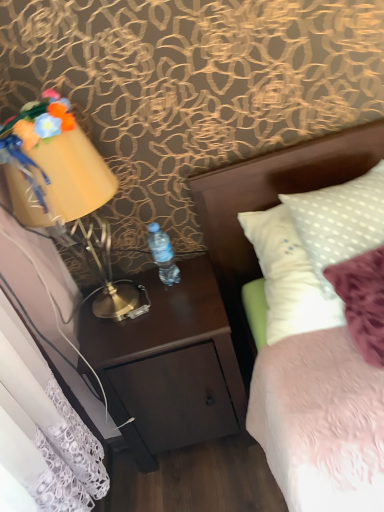
Question: From a real-world perspective, is matte yellow lampshade at left above or below fluffy fabric flowers at upper left?

Choices:
 (A) below
 (B) above

Answer: (A)

Question: Is point (142, 311) closer or farther from the camera than point (24, 120)?

Choices:
 (A) farther
 (B) closer

Answer: (A)

Question: Which object is the farthest from the fluffy fabric flowers at upper left?

Choices:
 (A) matte yellow lampshade at left
 (B) white fabric headboard at upper right
 (C) clear plastic bottle at center
 (D) dark wood nightstand at center

Answer: (D)

Question: Based on their relative distances, which object is farther from the dark wood nightstand at center?

Choices:
 (A) fluffy fabric flowers at upper left
 (B) matte yellow lampshade at left
 (C) clear plastic bottle at center
 (D) white fabric headboard at upper right

Answer: (A)